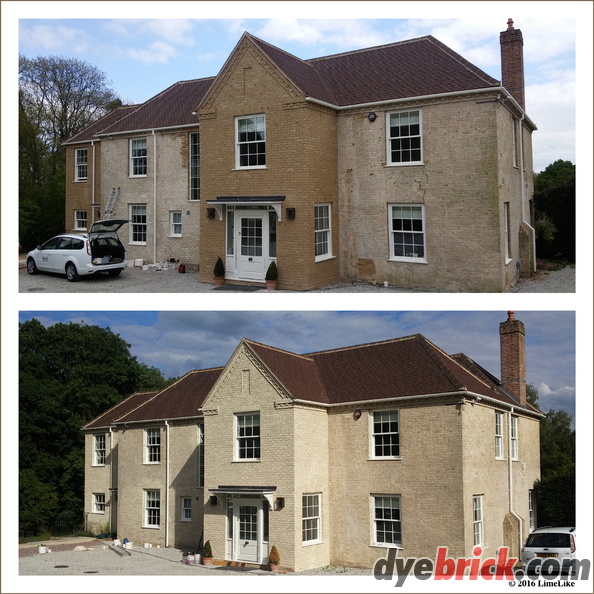
Where is `chimney`? chimney is located at coordinates (x=514, y=75), (x=511, y=341).